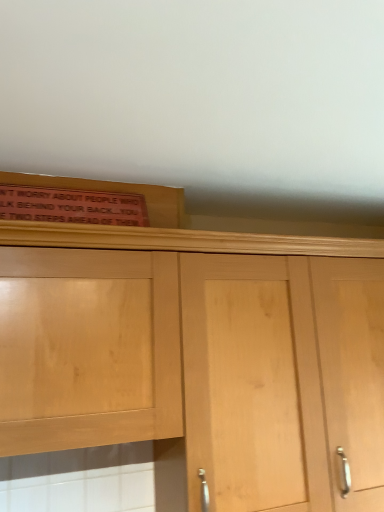
What do you see at coordinates (201, 357) in the screenshot? Image resolution: width=384 pixels, height=512 pixels. I see `light wood cabinet at upper center` at bounding box center [201, 357].

Where is `light wood cabinet at upper center`? The height and width of the screenshot is (512, 384). light wood cabinet at upper center is located at coordinates (201, 357).

Identify the location of light wood cabinet at upper center. Image resolution: width=384 pixels, height=512 pixels. (201, 357).